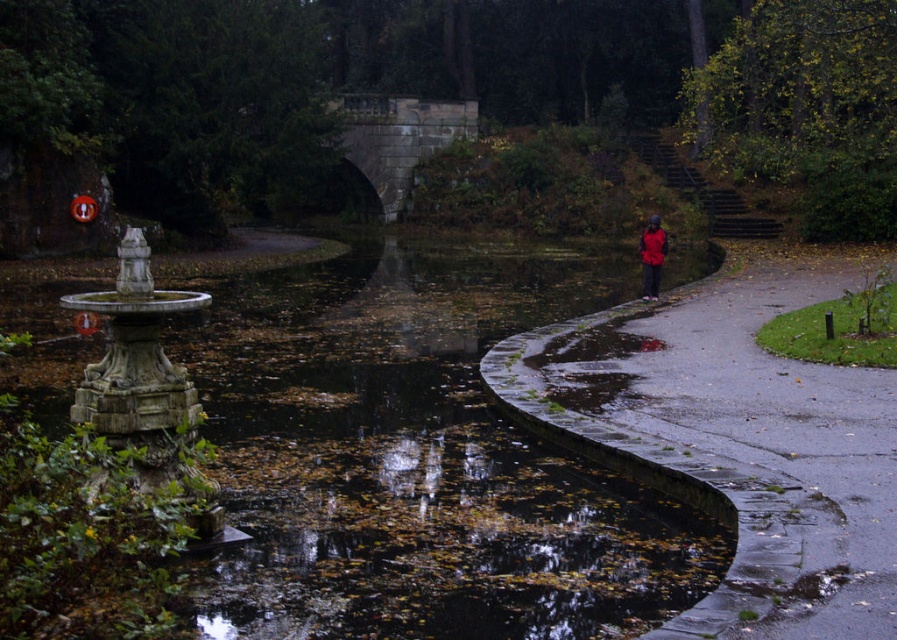
Question: Where is smooth asphalt path at right located in relation to red matte jacket at right in the image?

Choices:
 (A) below
 (B) above

Answer: (A)

Question: Can you confirm if smooth asphalt path at right is positioned below red matte jacket at right?

Choices:
 (A) no
 (B) yes

Answer: (B)

Question: Which object appears farthest from the camera in this image?

Choices:
 (A) red matte jacket at right
 (B) smooth asphalt path at right

Answer: (A)

Question: Does smooth asphalt path at right appear over red matte jacket at right?

Choices:
 (A) no
 (B) yes

Answer: (A)